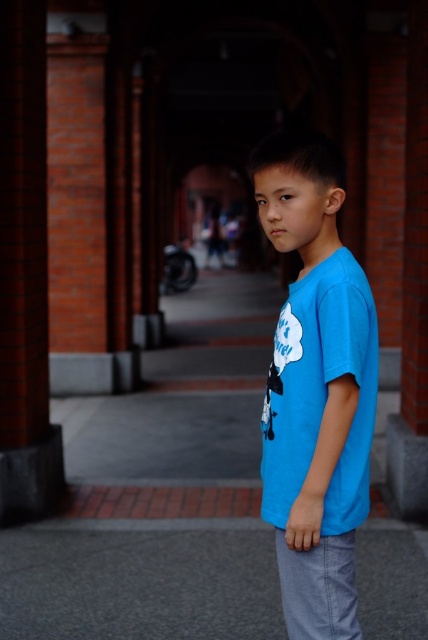
Who is lower down, blue cotton shirt at center or gray asphalt pavement at lower center?

Positioned lower is gray asphalt pavement at lower center.

Between blue cotton shirt at center and gray asphalt pavement at lower center, which one is positioned higher?

Positioned higher is blue cotton shirt at center.

Between point (345, 358) and point (5, 627), which one is positioned behind?

Positioned behind is point (5, 627).

Locate an element on the screen. The width and height of the screenshot is (428, 640). blue cotton shirt at center is located at coordinates (315, 388).